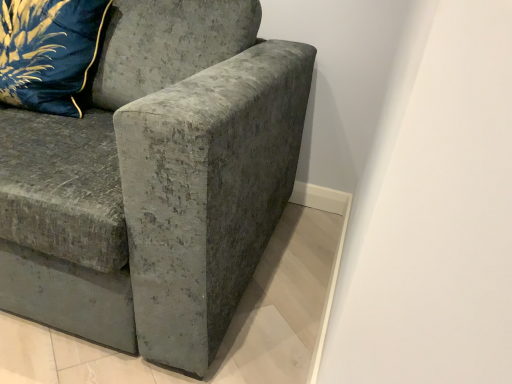
Question: From the image's perspective, is velvet blue pillow at upper left located above or below velvet gray couch at center?

Choices:
 (A) below
 (B) above

Answer: (B)

Question: Is velvet blue pillow at upper left to the left or to the right of velvet gray couch at center in the image?

Choices:
 (A) right
 (B) left

Answer: (B)

Question: From a real-world perspective, relative to velvet gray couch at center, is velvet blue pillow at upper left vertically above or below?

Choices:
 (A) above
 (B) below

Answer: (A)

Question: Would you say velvet gray couch at center is inside or outside velvet blue pillow at upper left?

Choices:
 (A) outside
 (B) inside

Answer: (A)

Question: Considering the relative positions of velvet gray couch at center and velvet blue pillow at upper left in the image provided, is velvet gray couch at center to the left or to the right of velvet blue pillow at upper left?

Choices:
 (A) left
 (B) right

Answer: (B)

Question: From a real-world perspective, is velvet gray couch at center above or below velvet blue pillow at upper left?

Choices:
 (A) above
 (B) below

Answer: (B)

Question: From the image's perspective, is velvet gray couch at center positioned above or below velvet blue pillow at upper left?

Choices:
 (A) below
 (B) above

Answer: (A)